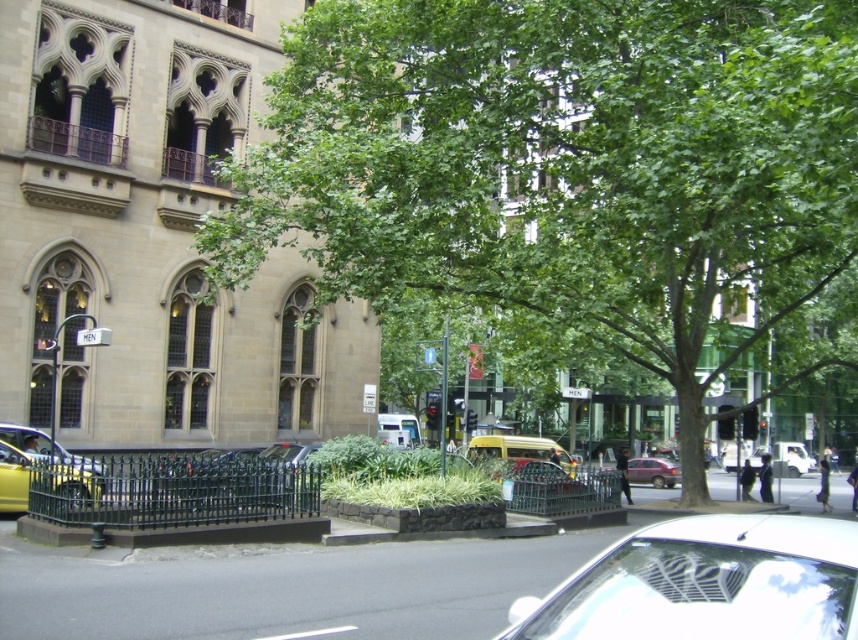
Consider the image. You are a delivery person needing to park your vehicle in the parking lot. You see a white glossy car at lower right and a matte red car at center. Which car is positioned higher up in the parking lot?

The white glossy car at lower right is located above the matte red car at center, so it is positioned higher up in the parking lot.

Consider the image. You are a delivery person who needs to park your van next to the white glossy car at lower right and the yellow matte taxi at center. Which vehicle should you park closer to so that your van doesn

The white glossy car at lower right occupies less space than the yellow matte taxi at center, so you should park closer to the white glossy car at lower right to save space.

You are standing in the urban street scene described. You need to park your car, which is 15 feet long, in a spot that is exactly where the white glossy car at lower right is currently parked. Is there enough space for your car to fit in that parking spot?

The white glossy car at lower right is positioned at a distance of 10.11 feet from the viewer. However, the provided information does not specify the length of the parking spot where the white glossy car at lower right is parked. Therefore, it is impossible to determine if your 15 feet long car would fit in that spot based on the given details.